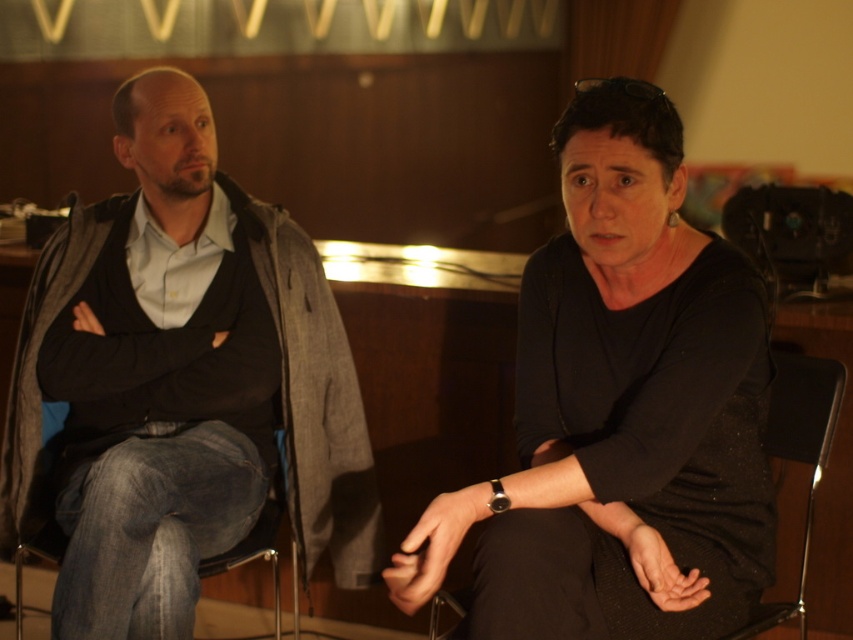
You are a photographer setting up for a portrait session. You need to position a light source between the black fabric chair at center and the denim fabric at left to ensure even lighting. Based on their positions, which object should the light be placed closer to?

The light should be placed closer to the black fabric chair at center since it is in front of the denim fabric at left, ensuring the light reaches both objects evenly without casting harsh shadows.

You are designing a seating arrangement for a small meeting room. You have a black fabric chair at center and a denim fabric at left. If you need to place both chairs side by side along a narrow wall, which chair would you choose to fit better in the limited space?

The denim fabric at left has a narrower width than the black fabric chair at center, so the denim fabric at left would fit better in the limited space.